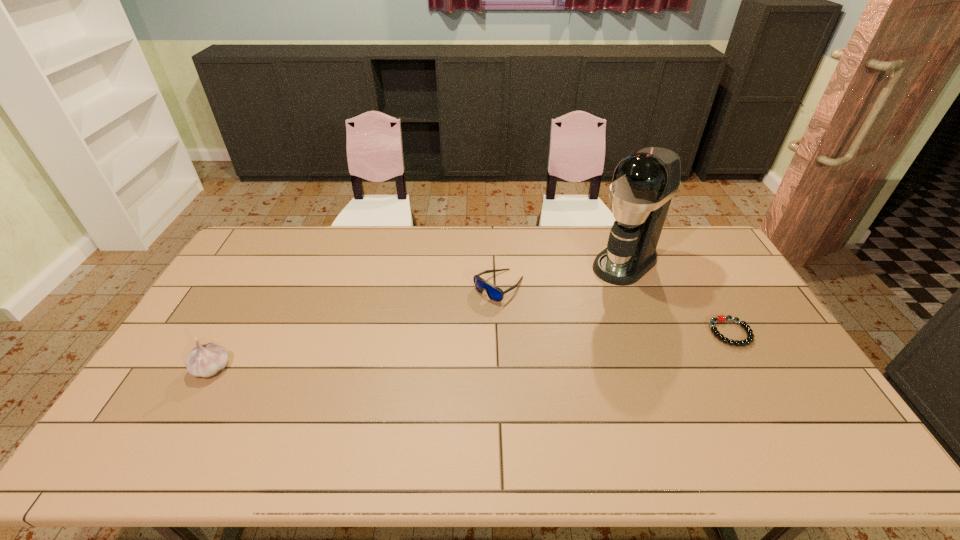
The height and width of the screenshot is (540, 960). In order to click on the nearest object in this screenshot , I will do `click(205, 360)`.

Where is `the leftmost object`? the leftmost object is located at coordinates (205, 360).

At what (x,y) coordinates should I click in order to perform the action: click on the rightmost object. Please return your answer as a coordinate pair (x, y). This screenshot has height=540, width=960. Looking at the image, I should click on (720, 318).

Locate an element on the screen. the shortest object is located at coordinates (720, 318).

The width and height of the screenshot is (960, 540). Find the location of `the tallest object`. the tallest object is located at coordinates (644, 183).

I want to click on the third object from left to right, so click(644, 183).

The width and height of the screenshot is (960, 540). What are the coordinates of `the third object from right to left` in the screenshot? It's located at (494, 293).

What are the coordinates of `sunglasses` in the screenshot? It's located at (494, 293).

At what (x,y) coordinates should I click in order to perform the action: click on vacant space situated on the right of the garlic. Please return your answer as a coordinate pair (x, y). The width and height of the screenshot is (960, 540). Looking at the image, I should click on (316, 368).

Identify the location of vacant space positioned 0.060m on the right of the rightmost object. The width and height of the screenshot is (960, 540). (770, 333).